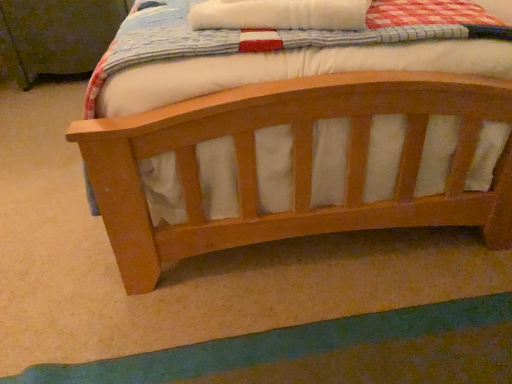
Describe the element at coordinates (56, 35) in the screenshot. I see `wooden changing table at upper left` at that location.

What do you see at coordinates (327, 352) in the screenshot? I see `green fabric at lower center` at bounding box center [327, 352].

In order to click on light brown wood bed at center in this screenshot , I will do `click(300, 148)`.

Which of these two, wooden changing table at upper left or green fabric at lower center, is thinner?

wooden changing table at upper left.

Is wooden changing table at upper left next to green fabric at lower center?

No, wooden changing table at upper left is not beside green fabric at lower center.

Between wooden changing table at upper left and green fabric at lower center, which one has larger size?

wooden changing table at upper left.

Is wooden changing table at upper left behind green fabric at lower center?

Yes.

Is light brown wood bed at center not within wooden changing table at upper left?

Yes.

Between light brown wood bed at center and wooden changing table at upper left, which one has more height?

With more height is wooden changing table at upper left.

From the picture: From the image's perspective, which object appears higher, light brown wood bed at center or wooden changing table at upper left?

wooden changing table at upper left appears higher in the image.

Looking at this image, between light brown wood bed at center and wooden changing table at upper left, which one has smaller size?

light brown wood bed at center.

Considering the positions of points (263, 237) and (334, 360), is point (263, 237) farther from camera compared to point (334, 360)?

Yes, point (263, 237) is behind point (334, 360).

Would you say light brown wood bed at center is a long distance from green fabric at lower center?

Actually, light brown wood bed at center and green fabric at lower center are a little close together.

Is light brown wood bed at center positioned with its back to green fabric at lower center?

No, green fabric at lower center is not at the back of light brown wood bed at center.

Considering the positions of objects green fabric at lower center and wooden changing table at upper left in the image provided, who is more to the right, green fabric at lower center or wooden changing table at upper left?

green fabric at lower center is more to the right.

How distant is green fabric at lower center from wooden changing table at upper left?

green fabric at lower center and wooden changing table at upper left are 1.80 meters apart.

Is green fabric at lower center facing towards wooden changing table at upper left?

No.

From a real-world perspective, is green fabric at lower center on wooden changing table at upper left?

No, from a real-world perspective, green fabric at lower center is not over wooden changing table at upper left

In the image, is wooden changing table at upper left positioned in front of or behind light brown wood bed at center?

Answer: wooden changing table at upper left is positioned farther from the viewer than light brown wood bed at center.

Considering the positions of point (20, 29) and point (216, 230), is point (20, 29) closer or farther from the camera than point (216, 230)?

Clearly, point (20, 29) is more distant from the camera than point (216, 230).

Considering the sizes of objects wooden changing table at upper left and light brown wood bed at center in the image provided, who is thinner, wooden changing table at upper left or light brown wood bed at center?

Thinner between the two is wooden changing table at upper left.

Could you tell me if wooden changing table at upper left is facing light brown wood bed at center?

Yes, wooden changing table at upper left is oriented towards light brown wood bed at center.

Which of these two, green fabric at lower center or light brown wood bed at center, stands taller?

With more height is green fabric at lower center.

Considering the sizes of objects green fabric at lower center and light brown wood bed at center in the image provided, who is thinner, green fabric at lower center or light brown wood bed at center?

green fabric at lower center.

Is green fabric at lower center surrounding light brown wood bed at center?

That's incorrect, light brown wood bed at center is not inside green fabric at lower center.

Locate an element on the screen. This screenshot has height=384, width=512. strip below the wooden changing table at upper left (from a real-world perspective) is located at coordinates (327, 352).

Where is `changing table above the light brown wood bed at center (from a real-world perspective)`? This screenshot has width=512, height=384. changing table above the light brown wood bed at center (from a real-world perspective) is located at coordinates tap(56, 35).

Based on their spatial positions, is green fabric at lower center or wooden changing table at upper left further from light brown wood bed at center?

wooden changing table at upper left is positioned further to the anchor light brown wood bed at center.

Estimate the real-world distances between objects in this image. Which object is closer to green fabric at lower center, light brown wood bed at center or wooden changing table at upper left?

The object closer to green fabric at lower center is light brown wood bed at center.

Looking at the image, which one is located closer to green fabric at lower center, wooden changing table at upper left or light brown wood bed at center?

Among the two, light brown wood bed at center is located nearer to green fabric at lower center.

Considering their positions, is wooden changing table at upper left positioned closer to light brown wood bed at center than green fabric at lower center?

Among the two, green fabric at lower center is located nearer to light brown wood bed at center.

Estimate the real-world distances between objects in this image. Which object is closer to wooden changing table at upper left, green fabric at lower center or light brown wood bed at center?

light brown wood bed at center is positioned closer to the anchor wooden changing table at upper left.

Which object lies further to the anchor point wooden changing table at upper left, light brown wood bed at center or green fabric at lower center?

The object further to wooden changing table at upper left is green fabric at lower center.

I want to click on strip between light brown wood bed at center and wooden changing table at upper left along the z-axis, so click(x=327, y=352).